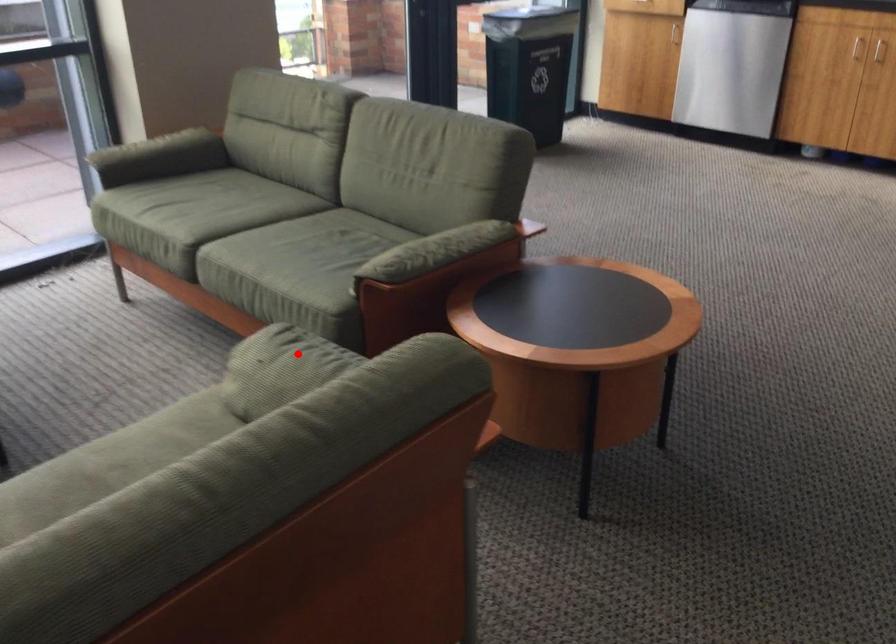
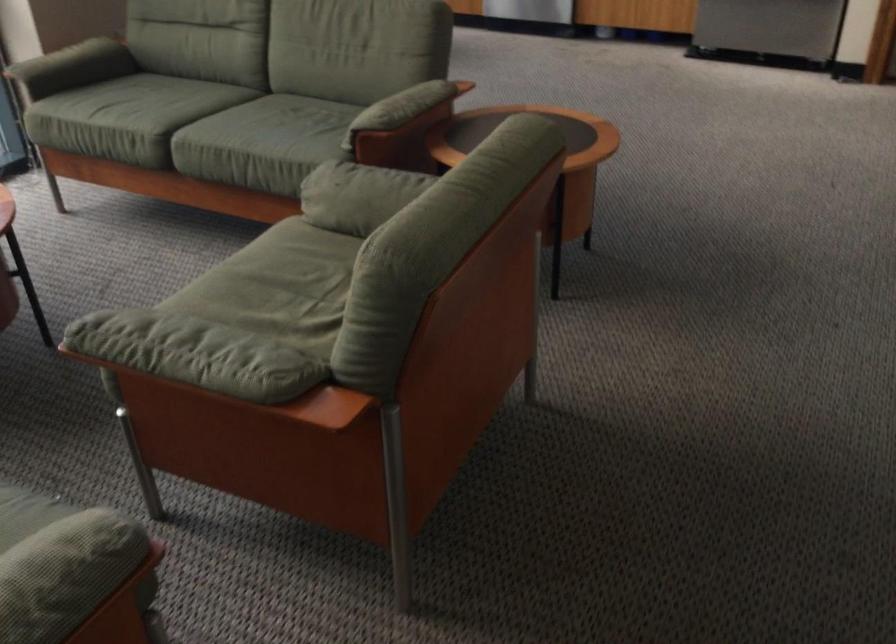
Locate, in the second image, the point that corresponds to the highlighted location in the first image.

(364, 176)